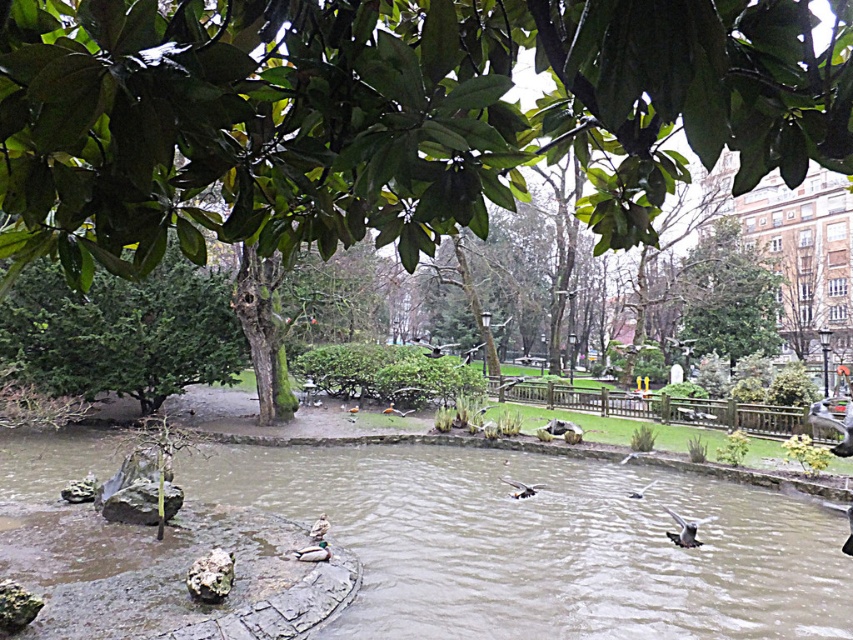
You are standing in the park and want to take a photo of the green leafy tree at upper center without the green matte duck at lower center blocking the view. Is it possible to do so from your current position?

The green leafy tree at upper center is in front of the green matte duck at lower center, so you cannot take a photo of the green leafy tree at upper center without the green matte duck at lower center blocking the view from your current position.

You are standing in the park and want to take a photo of the green leafy tree at upper center and the green matte duck at lower center. Which object should you focus on first if you want to capture both in a single frame without moving the camera?

The green leafy tree at upper center is located above the green matte duck at lower center, so you should focus on the green leafy tree at upper center first to ensure both are in the frame.

You are a bird watcher observing the park scene. You notice the green leafy tree at upper center and the green matte duck at lower center. Which object is larger in size?

The green leafy tree at upper center is bigger than the green matte duck at lower center.